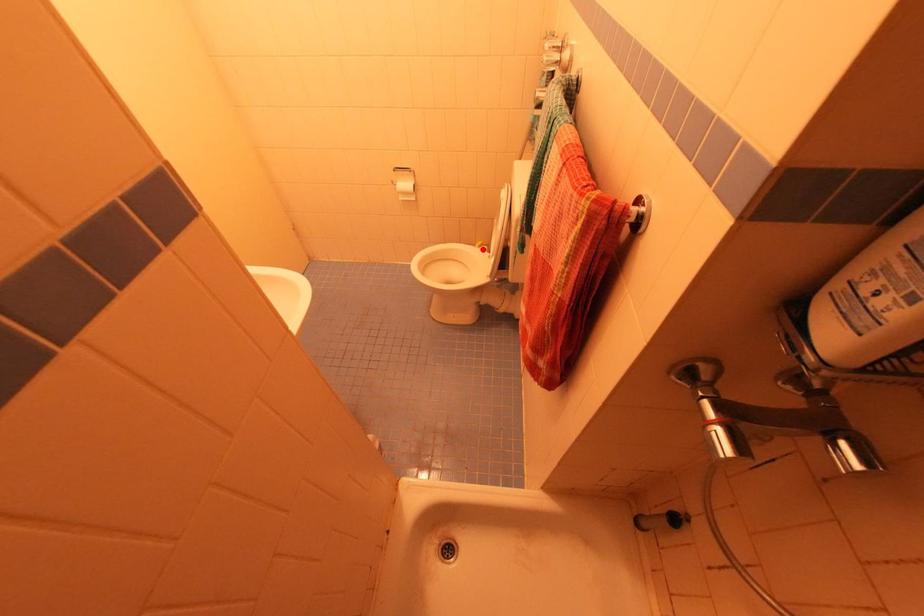
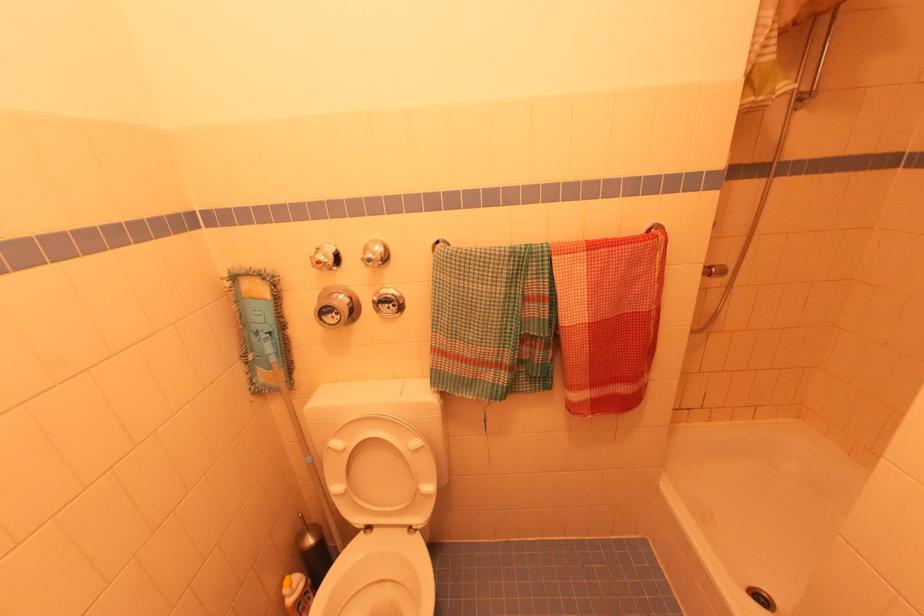
Question: I am providing you with two images of the same scene from different viewpoints. A red point is shown in image1. For the corresponding object point in image2, is it positioned nearer or farther from the camera?

Choices:
 (A) Nearer
 (B) Farther

Answer: (A)